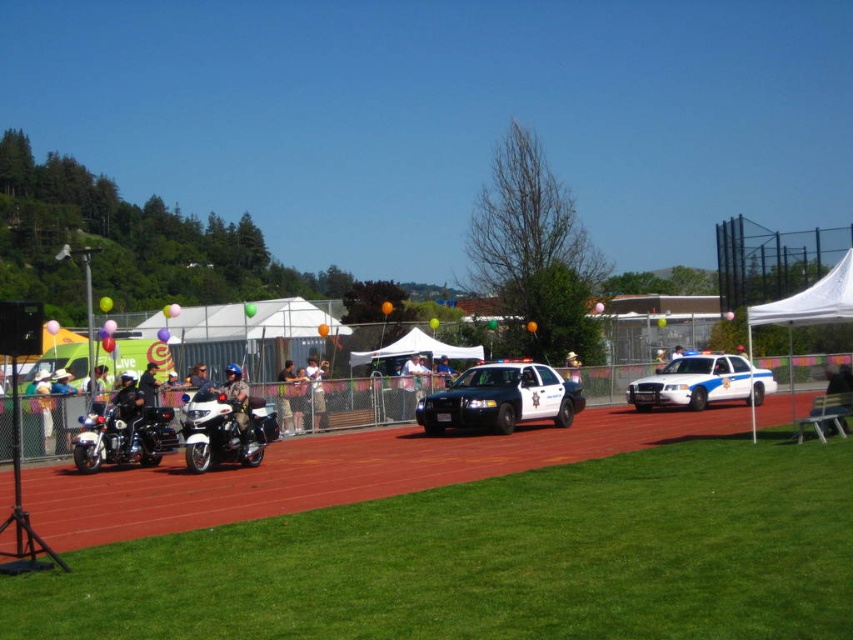
Which is more to the right, white fabric shirt at center or khaki woven hat at center?

khaki woven hat at center

Does point (316, 420) come in front of point (576, 376)?

Yes.

What are the coordinates of `white fabric shirt at center` in the screenshot? It's located at coord(316,390).

Which is in front, point (97, 452) or point (579, 381)?

Point (97, 452) is more forward.

From the picture: Is shiny chrome motorcycle at left closer to camera compared to khaki woven hat at center?

Yes.

Where is `shiny chrome motorcycle at left`? This screenshot has height=640, width=853. shiny chrome motorcycle at left is located at coordinates (123, 435).

Does point (367, 477) come closer to viewer compared to point (445, 388)?

Yes.

Based on the photo, who is positioned more to the right, smooth asphalt race track at center or metallic blue police car at center?

metallic blue police car at center is more to the right.

What are the coordinates of `smooth asphalt race track at center` in the screenshot? It's located at 334,472.